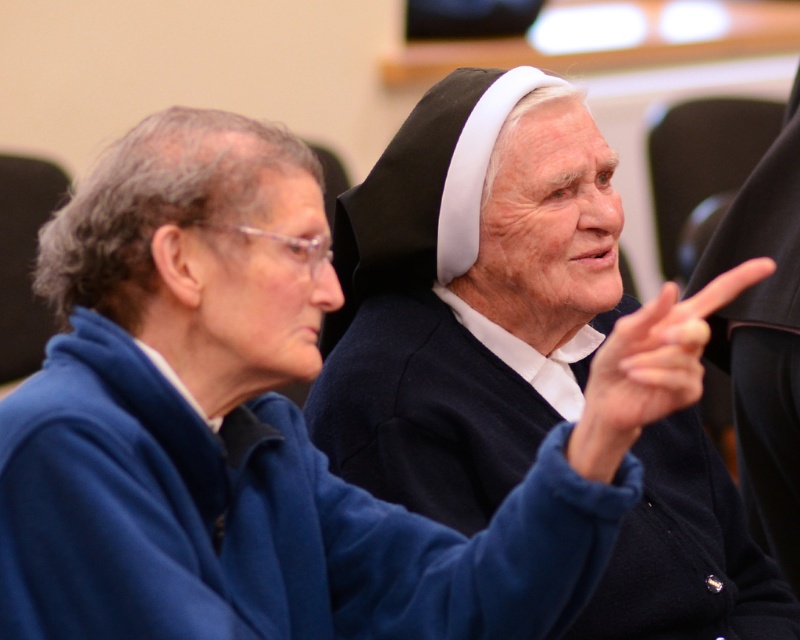
Question: Among these objects, which one is farthest from the camera?

Choices:
 (A) matte black nun's habit at upper center
 (B) smooth skin finger at center

Answer: (A)

Question: Which point is farther to the camera?

Choices:
 (A) (132, 588)
 (B) (425, 461)

Answer: (B)

Question: Can you confirm if blue fleece robe at center is bigger than smooth skin finger at center?

Choices:
 (A) no
 (B) yes

Answer: (B)

Question: Among these objects, which one is nearest to the camera?

Choices:
 (A) smooth skin finger at center
 (B) matte black nun's habit at upper center
 (C) blue fleece robe at center

Answer: (C)

Question: Considering the relative positions of blue fleece robe at center and smooth skin finger at center in the image provided, where is blue fleece robe at center located with respect to smooth skin finger at center?

Choices:
 (A) left
 (B) right

Answer: (A)

Question: In this image, where is blue fleece robe at center located relative to smooth skin finger at center?

Choices:
 (A) above
 (B) below

Answer: (B)